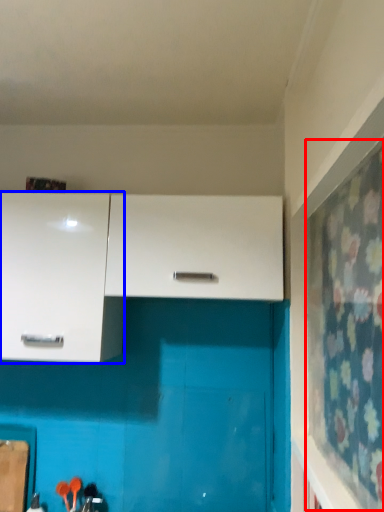
Question: Which point is further to the camera, curtain (highlighted by a red box) or cabinetry (highlighted by a blue box)?

Choices:
 (A) curtain
 (B) cabinetry

Answer: (B)